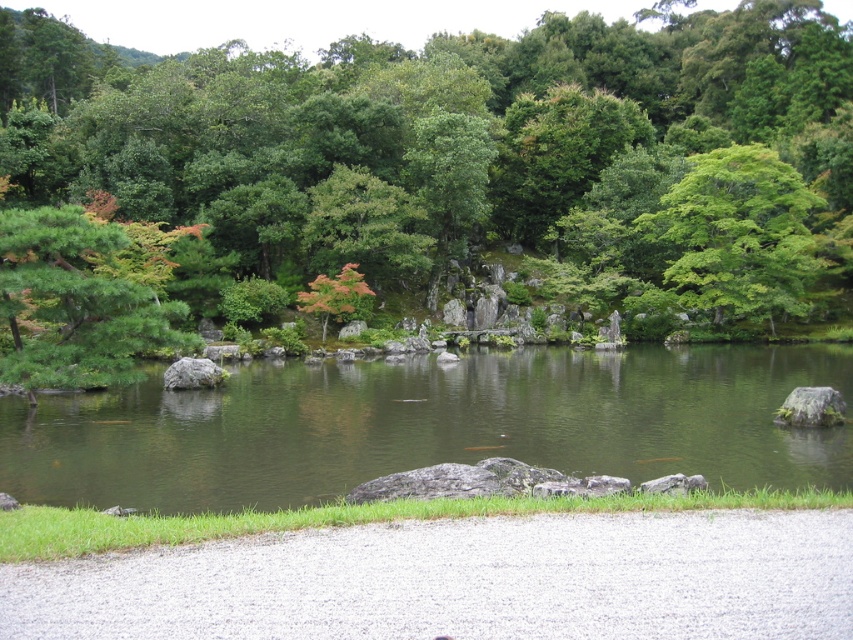
Who is more forward, (434,180) or (720,244)?

Positioned in front is point (720,244).

Which is behind, point (339, 140) or point (727, 228)?

The point (339, 140) is behind.

Find the location of a particular element. The image size is (853, 640). green leafy tree at center is located at coordinates (467, 156).

Does green leafy tree at center have a lesser height compared to green smooth water at center?

No.

Consider the image. Is green leafy tree at center closer to camera compared to green smooth water at center?

No, it is not.

This screenshot has height=640, width=853. I want to click on green leafy tree at center, so click(x=467, y=156).

Where is `green leafy tree at center`? The width and height of the screenshot is (853, 640). green leafy tree at center is located at coordinates (467, 156).

Find the location of a particular element. green matte tree at left is located at coordinates (82, 298).

Is point (129, 355) positioned after point (357, 276)?

No, (129, 355) is in front of (357, 276).

Describe the element at coordinates (82, 298) in the screenshot. The height and width of the screenshot is (640, 853). I see `green matte tree at left` at that location.

You are a GUI agent. You are given a task and a screenshot of the screen. Output one action in this format:
    pyautogui.click(x=<x>, y=<y>)
    Task: Click on the green matte tree at left
    
    Given the screenshot: What is the action you would take?
    pyautogui.click(x=82, y=298)